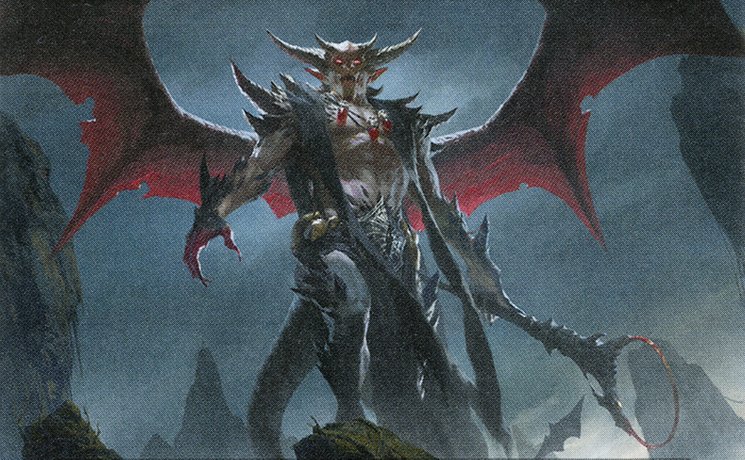
The width and height of the screenshot is (745, 460). Identify the location of chest. (358, 147).